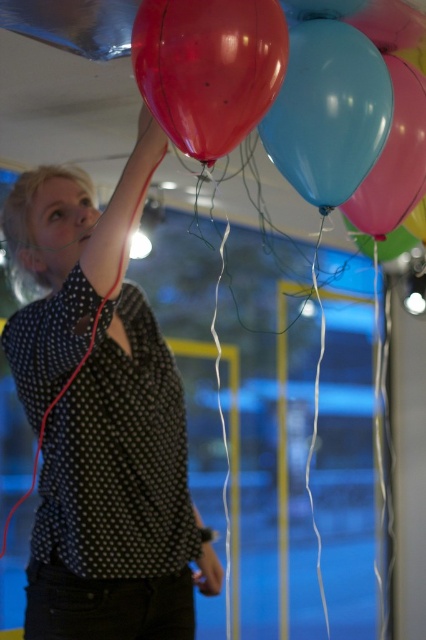
Consider the image. You are a delivery person who needs to carefully transport the glossy rubber balloon at upper center without touching the matte black shirt at upper left. Given that the distance between them is 25.58 inches, can you safely move the balloon if your minimum required safety distance is 24 inches?

The distance between the matte black shirt at upper left and the glossy rubber balloon at upper center is 25.58 inches, which exceeds the required 24 inches safety distance. Therefore, you can safely move the balloon without touching the shirt.

You are a photographer trying to capture the glossy blue balloon at center without the matte black shirt at upper left blocking it. Based on the scene, can you adjust your position to achieve this?

The glossy blue balloon at center is behind the matte black shirt at upper left, so moving your position to the side or angle your camera might help avoid the obstruction.